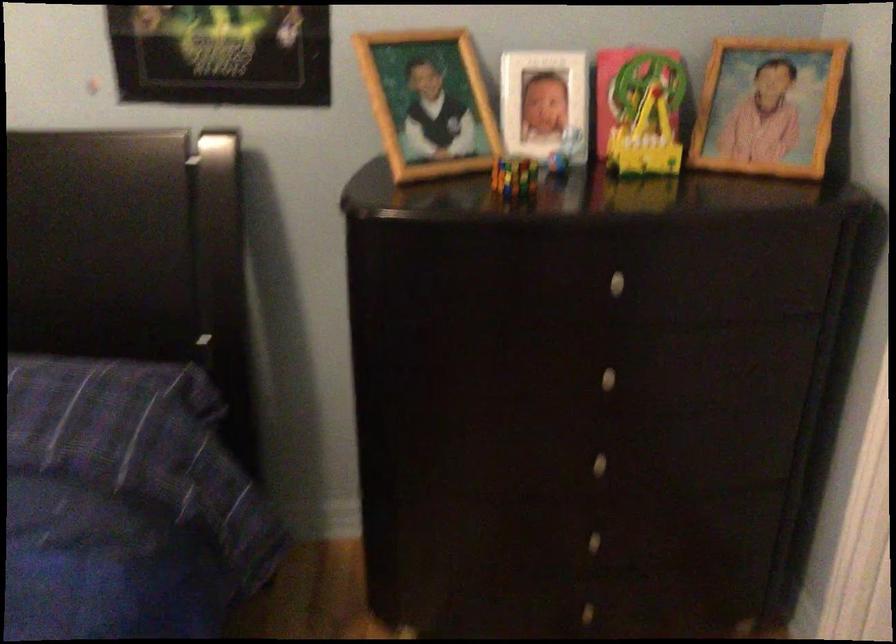
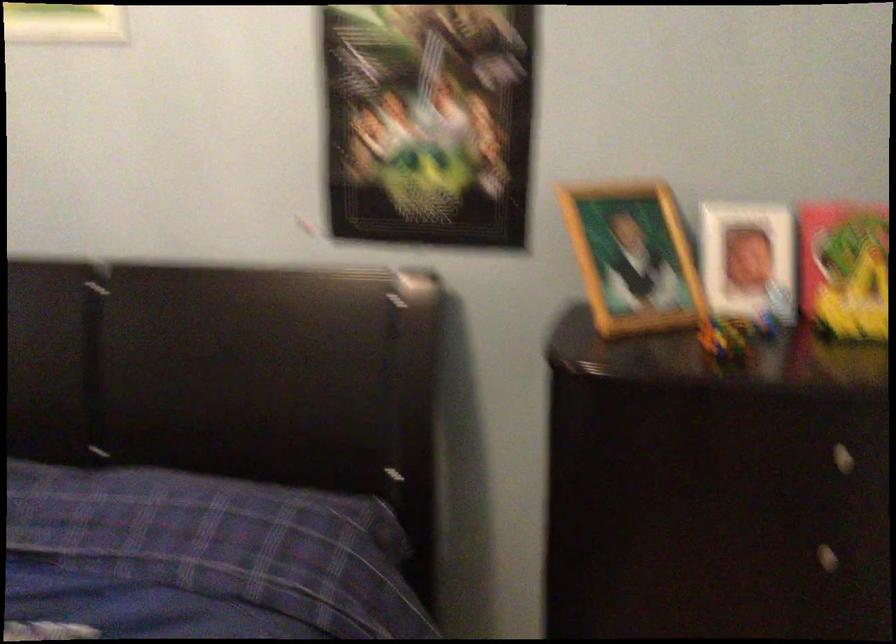
Question: The images are taken continuously from a first-person perspective. In which direction are you moving?

Choices:
 (A) Left
 (B) Right
 (C) Forward
 (D) Backward

Answer: (A)